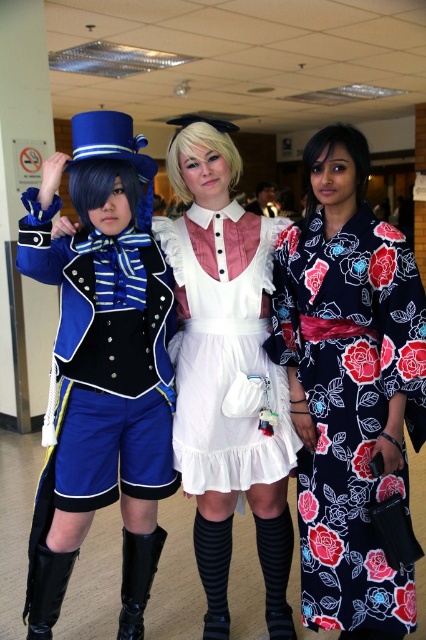
In the scene shown: You are standing at the entrance of the convention center and see two points marked in the image. The first point is at coordinate point (29, 230) and the second point is at coordinate point (149, 556). Which point is closer to you?

Point (29, 230) is in front of point (149, 556), so it is closer to you.

You are a photographer at a cosplay event and want to position your camera to capture both the black leather boot at lower center and the black leather boot at lower left in the same frame. Which boot should you focus on first to ensure both are in focus?

The black leather boot at lower left is thicker than the black leather boot at lower center, so focusing on the thicker boot first will help ensure both are in focus.

You are a photographer at the event and need to ensure all items are visible in your shot. Given that the white satin dress at center and the black leather boot at lower center are part of the same costume, which item requires more space in the frame?

The white satin dress at center requires more space in the frame because it is bigger than the black leather boot at lower center.